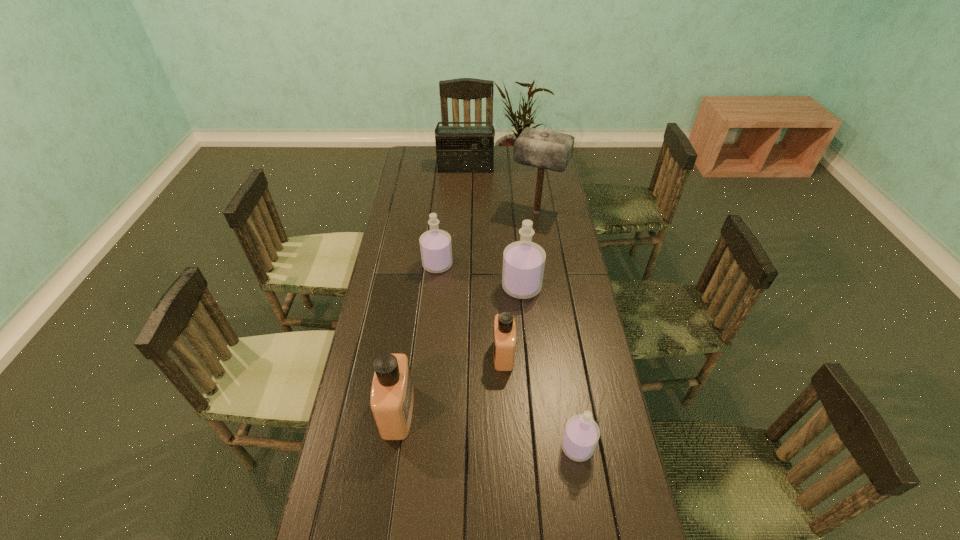
The image size is (960, 540). I want to click on vacant area that satisfies the following two spatial constraints: 1. on the back side of the fifth shortest object; 2. on the right side of the mallet, so click(515, 212).

I want to click on blank space that satisfies the following two spatial constraints: 1. on the front side of the second farthest object; 2. on the left side of the smallest purple perfume, so click(x=572, y=447).

This screenshot has width=960, height=540. Identify the location of free space that satisfies the following two spatial constraints: 1. on the front panel of the radio receiver; 2. on the left side of the tallest perfume. (461, 287).

Where is `vacant position in the image that satisfies the following two spatial constraints: 1. on the front label of the right beige perfume; 2. on the right side of the nearest purple perfume`? The width and height of the screenshot is (960, 540). vacant position in the image that satisfies the following two spatial constraints: 1. on the front label of the right beige perfume; 2. on the right side of the nearest purple perfume is located at coordinates (508, 447).